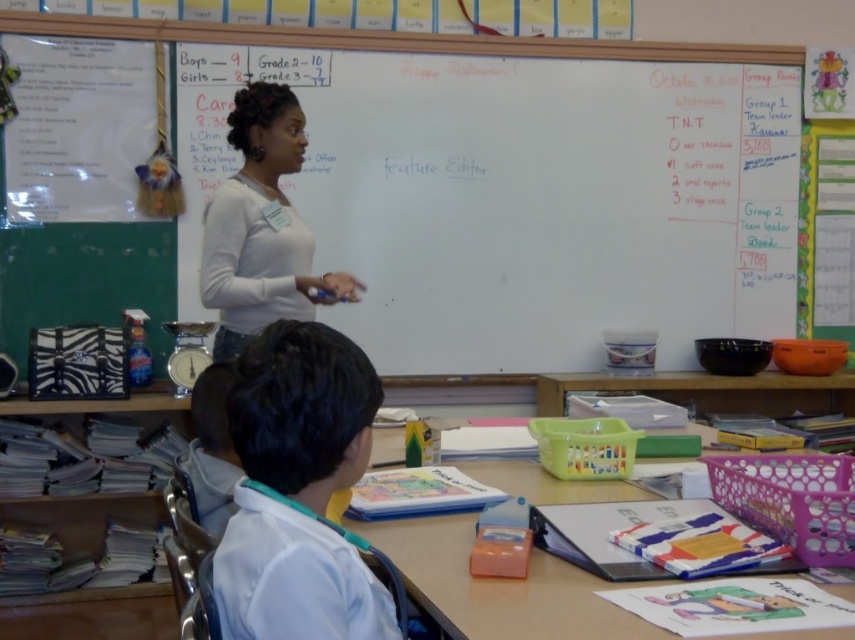
Is whiteboard at upper center below white matte shirt at center?

Actually, whiteboard at upper center is above white matte shirt at center.

Can you confirm if whiteboard at upper center is smaller than white matte shirt at center?

No, whiteboard at upper center is not smaller than white matte shirt at center.

Does point (506, 195) come in front of point (332, 276)?

No, it is behind (332, 276).

The image size is (855, 640). Identify the location of whiteboard at upper center. (522, 198).

Who is more distant from viewer, (343, 611) or (228, 115)?

Positioned behind is point (228, 115).

Is point (332, 332) in front of point (286, 200)?

Yes, it is in front of point (286, 200).

Where is `white smooth shirt at lower left`? Image resolution: width=855 pixels, height=640 pixels. white smooth shirt at lower left is located at coordinates (298, 490).

Based on the photo, which is more to the left, whiteboard at upper center or white smooth shirt at lower left?

Positioned to the left is white smooth shirt at lower left.

Measure the distance between point (373, 129) and camera.

They are 3.73 meters apart.

Locate an element on the screen. This screenshot has width=855, height=640. whiteboard at upper center is located at coordinates (522, 198).